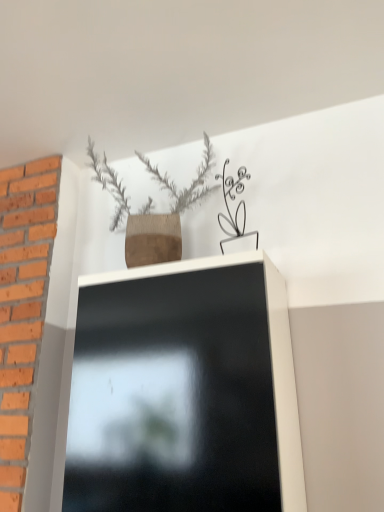
What do you see at coordinates (152, 208) in the screenshot? I see `burlap textured vase at upper center` at bounding box center [152, 208].

At what (x,y) coordinates should I click in order to perform the action: click on burlap textured vase at upper center. Please return your answer as a coordinate pair (x, y). The height and width of the screenshot is (512, 384). Looking at the image, I should click on (152, 208).

The height and width of the screenshot is (512, 384). In order to click on burlap textured vase at upper center in this screenshot , I will do `click(152, 208)`.